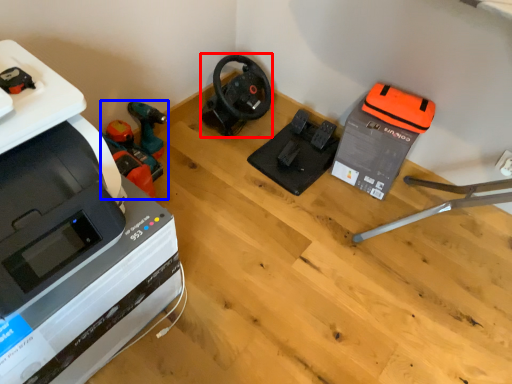
Question: Which object is further to the camera taking this photo, vacuum (highlighted by a red box) or vacuum (highlighted by a blue box)?

Choices:
 (A) vacuum
 (B) vacuum

Answer: (A)